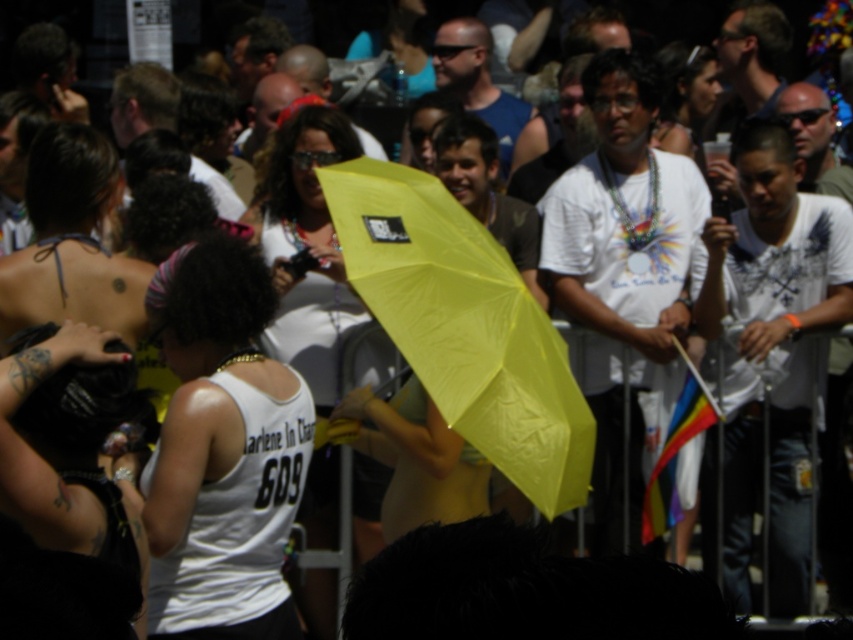
You are at an outdoor event and notice a person wearing a white matte tank top at center and holding a yellow matte umbrella at center. Can you tell if the tank top is protected from the sun by the umbrella?

The white matte tank top at center is positioned under the yellow matte umbrella at center, so yes, the tank top is protected from the sun by the umbrella.

You are a photographer trying to capture a clear shot of the yellow matte umbrella at center. However, there is a white matte tank top at center in the way. Based on their heights, can you determine if the umbrella will be visible behind the tank top?

The white matte tank top at center is taller than the yellow matte umbrella at center, so the umbrella may be partially or fully obscured by the tank top depending on their exact positions.

You are a photographer trying to capture a clear shot of the white matte tank top at center and the matte yellow umbrella at center. Which object should you focus on first to ensure it appears sharp in the photo?

The white matte tank top at center is closer to the viewer than the matte yellow umbrella at center, so you should focus on the white matte tank top at center first to ensure it appears sharp.